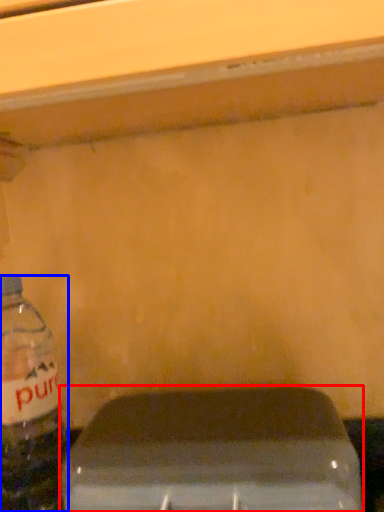
Question: Which of the following is the closest to the observer, appliance (highlighted by a red box) or bottle (highlighted by a blue box)?

Choices:
 (A) appliance
 (B) bottle

Answer: (A)